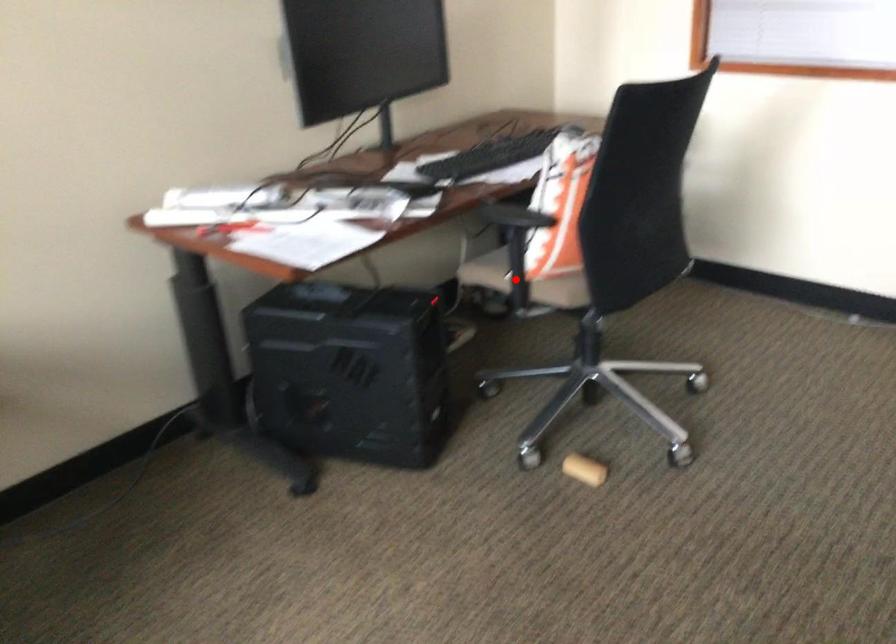
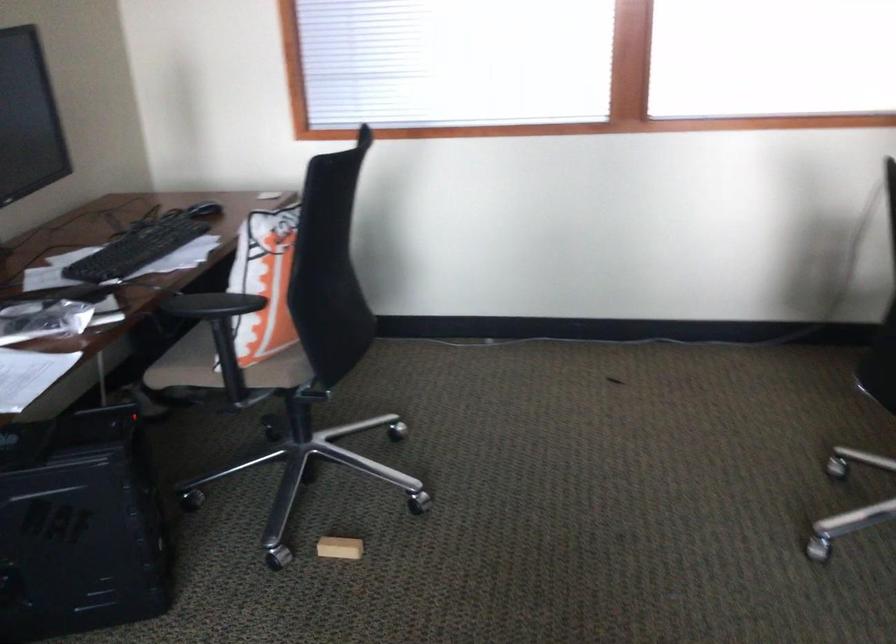
Find the pixel in the second image that matches the highlighted location in the first image.

(228, 370)